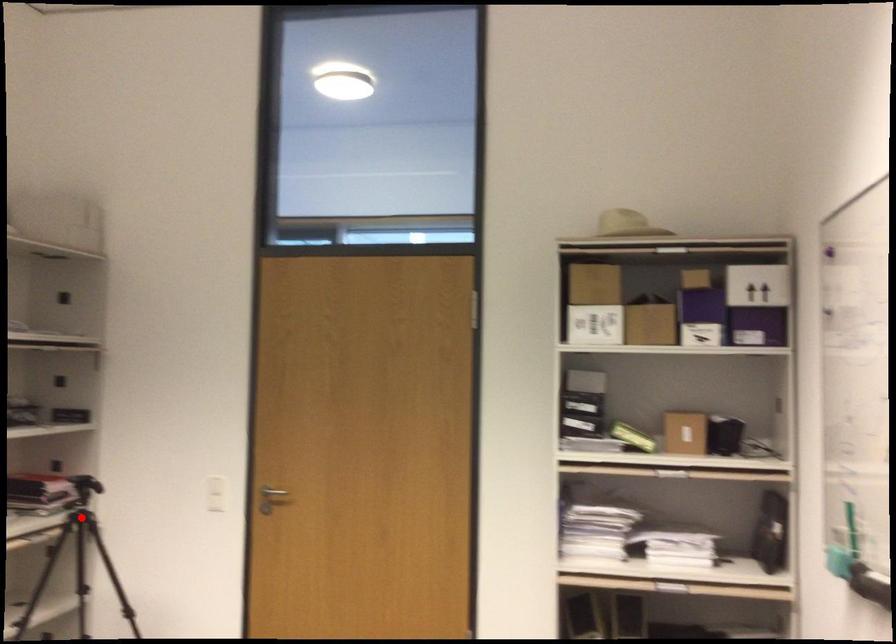
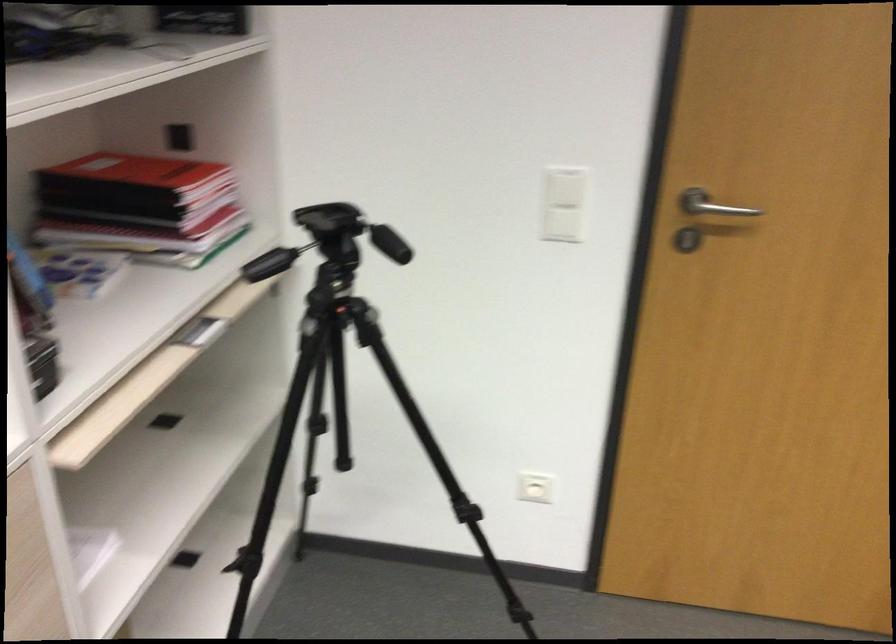
Find the pixel in the second image that matches the highlighted location in the first image.

(334, 313)